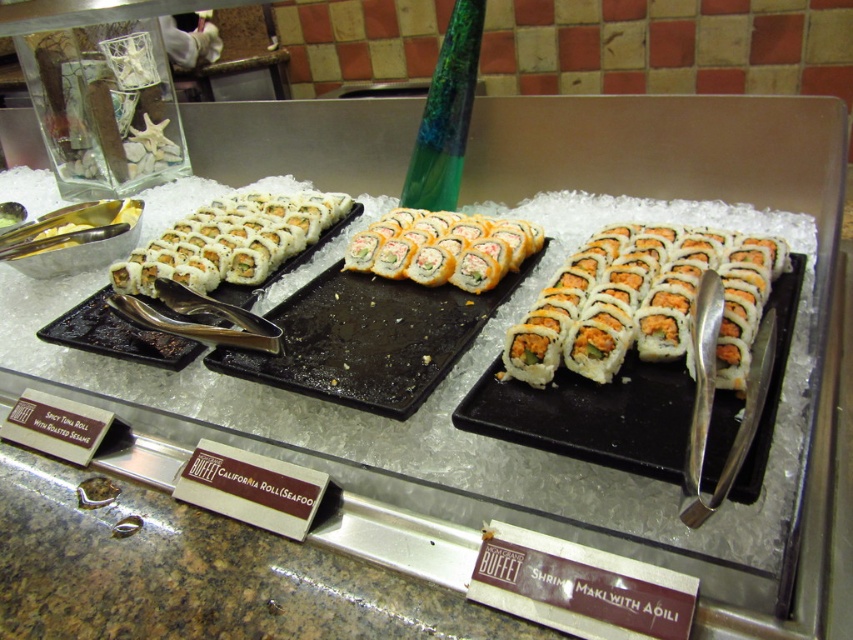
Does black matte california roll at center have a greater width compared to white rice paper at center?

Yes.

Which is below, black matte california roll at center or white rice paper at center?

Positioned lower is black matte california roll at center.

Identify the location of black matte california roll at center. The width and height of the screenshot is (853, 640). (369, 339).

In the scene shown: Who is more forward, (756, 289) or (309, 212)?

Point (756, 289)

In the scene shown: Can you confirm if white rice wrapped sushi at center is positioned to the right of white rice roll at left?

Correct, you'll find white rice wrapped sushi at center to the right of white rice roll at left.

Describe the element at coordinates (643, 301) in the screenshot. I see `white rice wrapped sushi at center` at that location.

Identify the location of white rice wrapped sushi at center. (643, 301).

Does white matte sushi roll at center appear on the right side of white rice paper at center?

Indeed, white matte sushi roll at center is positioned on the right side of white rice paper at center.

Is point (770, 305) positioned behind point (68, 323)?

No, it is in front of (68, 323).

Find the location of a particular element. white matte sushi roll at center is located at coordinates (590, 416).